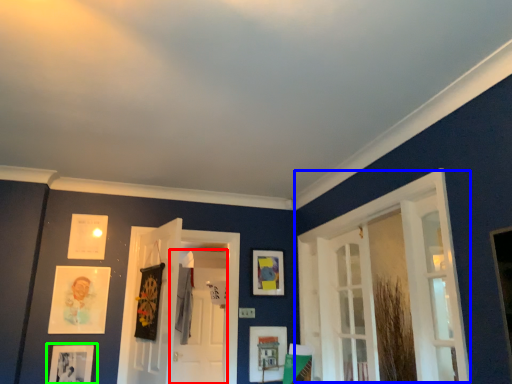
Question: Considering the real-world distances, which object is farthest from screen door (highlighted by a red box)? window (highlighted by a blue box) or picture frame (highlighted by a green box)?

Choices:
 (A) window
 (B) picture frame

Answer: (A)